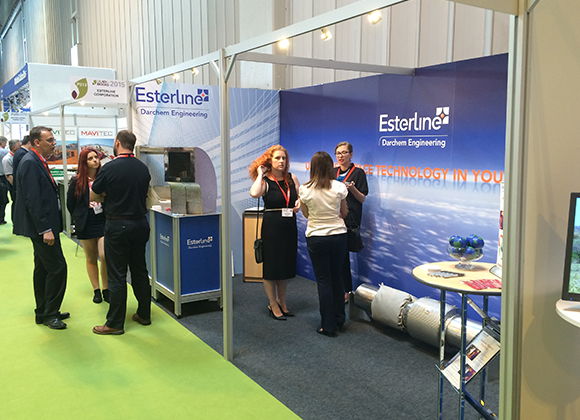
Locate an element on the screen. The width and height of the screenshot is (580, 420). floor is located at coordinates (179, 366).